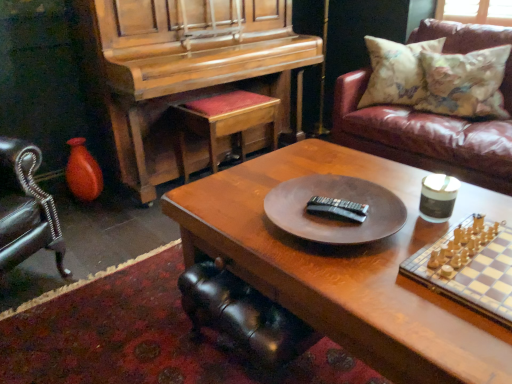
Identify the location of blank space above wooden cushioned stool at center (from a real-world perspective). (224, 99).